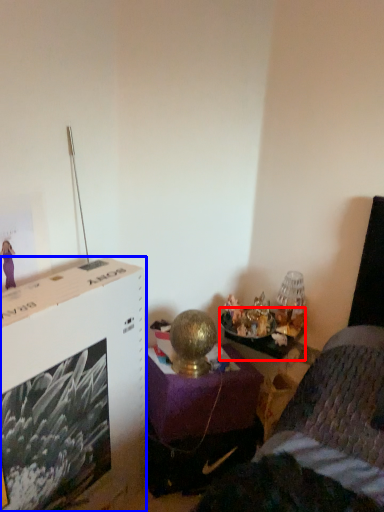
Question: Which object is further to the camera taking this photo, table (highlighted by a red box) or file cabinet (highlighted by a blue box)?

Choices:
 (A) table
 (B) file cabinet

Answer: (A)